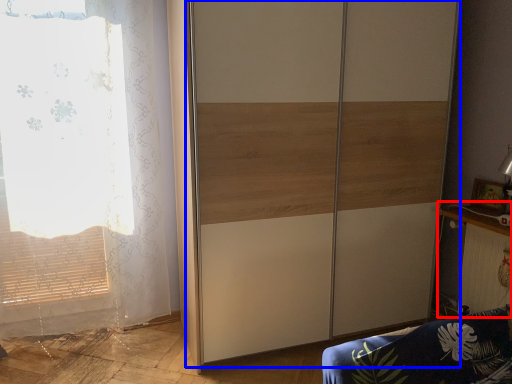
Question: Which point is further to the camera, table (highlighted by a red box) or screen door (highlighted by a blue box)?

Choices:
 (A) table
 (B) screen door

Answer: (A)